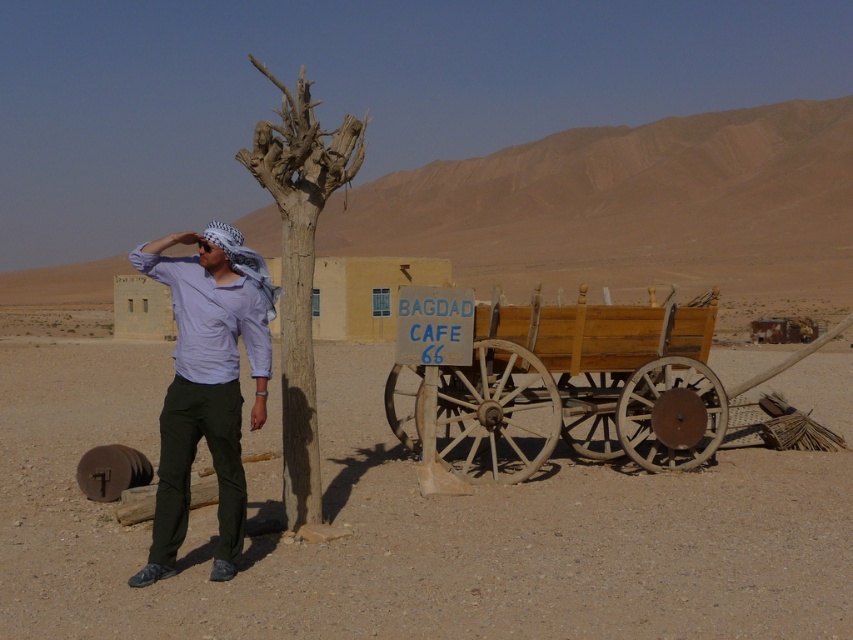
Can you confirm if matte purple shirt at left is positioned below brown rough tree at center?

Correct, matte purple shirt at left is located below brown rough tree at center.

Which is behind, point (241, 292) or point (251, 419)?

Positioned behind is point (251, 419).

I want to click on matte purple shirt at left, so click(207, 384).

Is wooden wagon at center below matte purple shirt at left?

Yes.

Does wooden wagon at center come in front of matte purple shirt at left?

No, it is not.

Does point (653, 355) come closer to viewer compared to point (256, 266)?

That is False.

Image resolution: width=853 pixels, height=640 pixels. What are the coordinates of `wooden wagon at center` in the screenshot? It's located at point(567,385).

In the scene shown: Is wooden wagon at center wider than brown rough tree at center?

Incorrect, wooden wagon at center's width does not surpass brown rough tree at center's.

Is point (515, 369) less distant than point (294, 208)?

No, it is not.

Identify the location of wooden wagon at center. Image resolution: width=853 pixels, height=640 pixels. (567, 385).